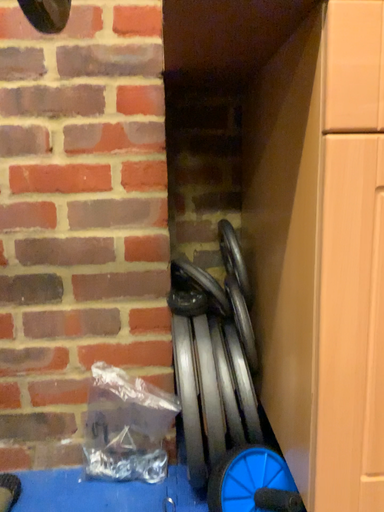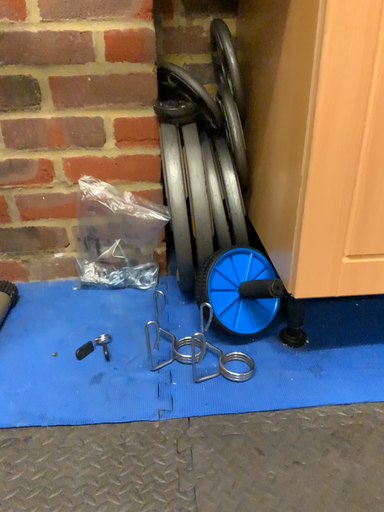
Question: Which way did the camera rotate in the video?

Choices:
 (A) rotated upward
 (B) rotated downward

Answer: (B)